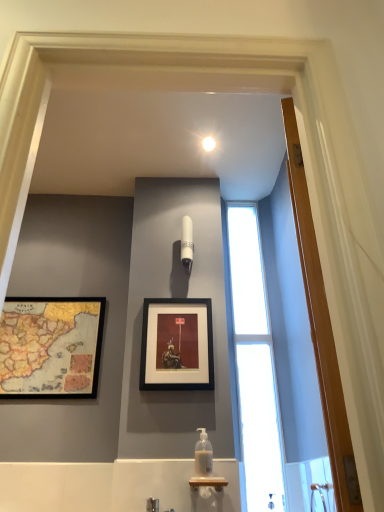
Question: Looking at the image, does wooden door at right seem bigger or smaller compared to black matte picture frame at center, which is counted as the first picture frame, starting from the right?

Choices:
 (A) small
 (B) big

Answer: (B)

Question: Is point (291, 164) closer or farther from the camera than point (150, 334)?

Choices:
 (A) closer
 (B) farther

Answer: (A)

Question: Which object is positioned closest to the wooden door at right?

Choices:
 (A) translucent plastic soap dispenser at center
 (B) white glossy light fixture at upper center
 (C) black matte picture frame at center, the 2th picture frame when ordered from left to right
 (D) white glossy light fixture at upper center
 (E) transparent glass window at center

Answer: (C)

Question: Which is farther from the transparent glass window at center?

Choices:
 (A) white glossy light fixture at upper center
 (B) wooden framed map at left, arranged as the 2th picture frame when viewed from the right
 (C) black matte picture frame at center, which is counted as the first picture frame, starting from the right
 (D) wooden door at right
 (E) brushed metal faucet at lower center

Answer: (D)